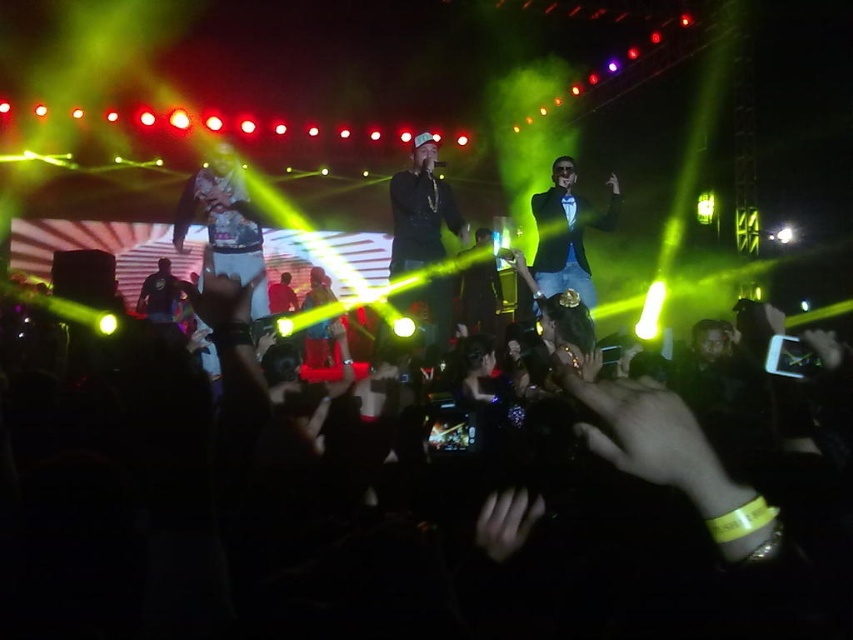
You are standing at the origin point of the coordinate system in the concert venue. The black fabric crowd at lower center is at position 0.811 on the x axis and 0.603 on the y axis. If you want to move towards the stage, which direction should you go from your current position?

Since the black fabric crowd at lower center is located at coordinates x 0.811 and y 0.603, moving towards the stage would require moving in the negative y direction to reduce the y coordinate, as the stage is likely positioned at a lower y coordinate in the image coordinate system.

From the picture: You are a photographer at the concert. You want to take a photo of the blue satin blazer at center without the black fabric crowd at lower center blocking it. Is it possible based on their positions?

The black fabric crowd at lower center is positioned under the blue satin blazer at center, so the blazer is above the crowd. Therefore, the photographer can take a photo of the blue satin blazer at center without the black fabric crowd at lower center blocking it by angling the camera upwards or adjusting the framing to focus on the upper area where the blazer is located.

You are a photographer at the concert and want to capture both the black leather jacket at center and the blue satin blazer at center in a single shot. Which one should you focus on first to ensure both are in frame?

The black leather jacket at center is taller than the blue satin blazer at center, so focus on the black leather jacket at center first to ensure both fit within the frame.